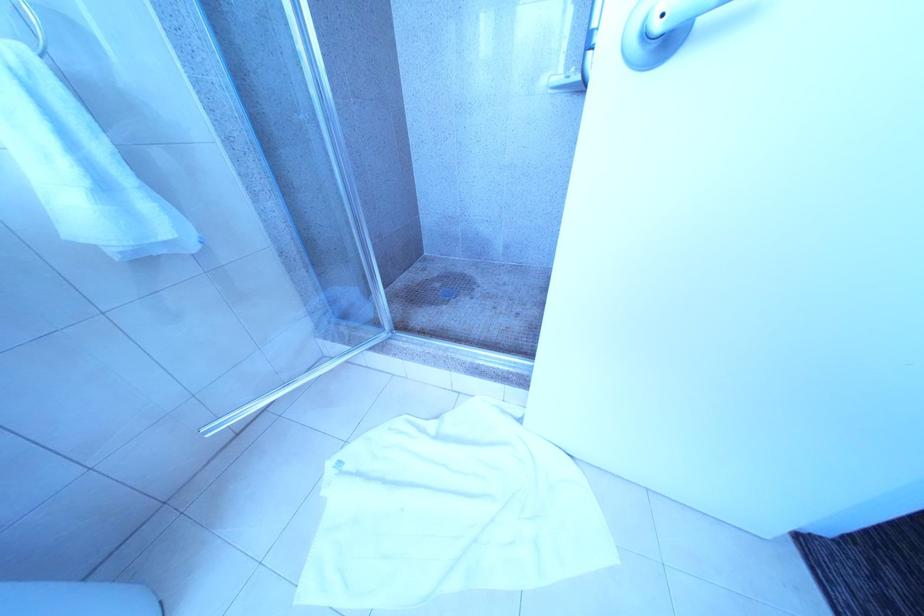
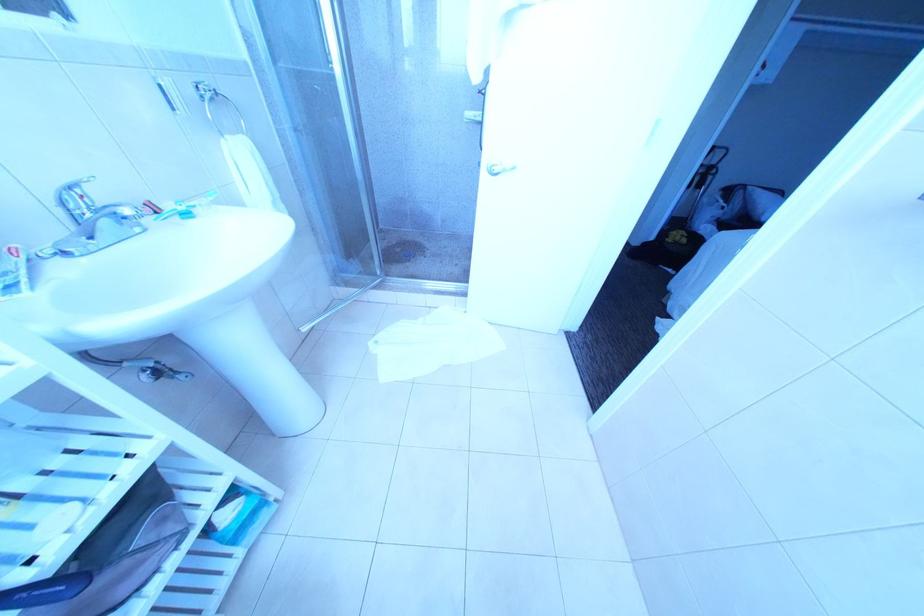
Question: Based on the continuous images, in which direction is the camera rotating? Reply with the corresponding letter.

Choices:
 (A) Left
 (B) Right
 (C) Up
 (D) Down

Answer: (B)